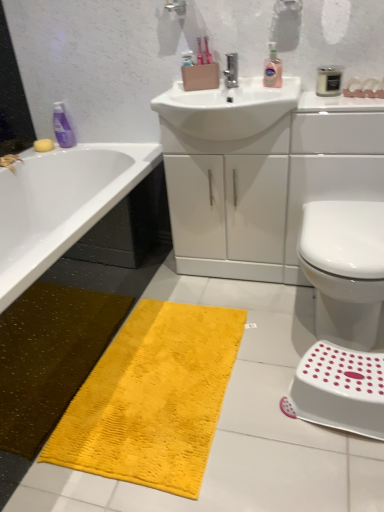
At what (x,y) coordinates should I click in order to perform the action: click on vacant area that lies to the right of polished chrome tap at center. Please return your answer as a coordinate pair (x, y). This screenshot has height=512, width=384. Looking at the image, I should click on (270, 85).